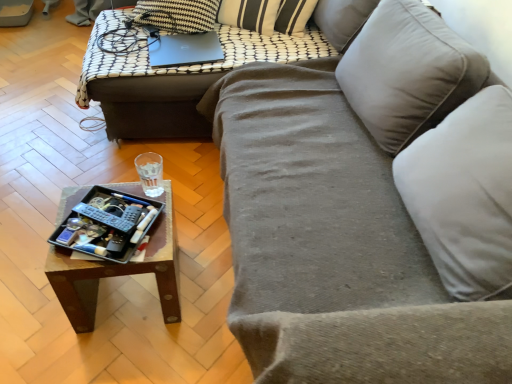
The width and height of the screenshot is (512, 384). I want to click on vacant space in front of wooden tray at center, so click(109, 356).